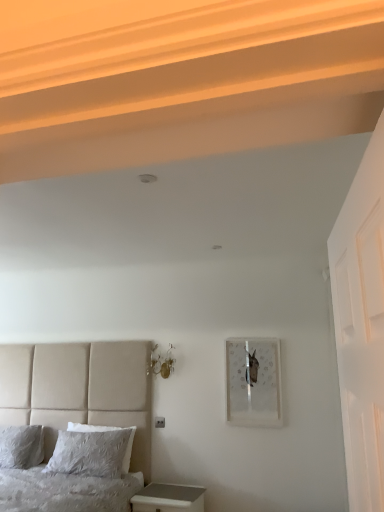
Question: Looking at their shapes, would you say beige fabric bed at lower left, positioned as the second bed in back-to-front order, is wider or thinner than metallic glass sconces at upper center?

Choices:
 (A) wide
 (B) thin

Answer: (A)

Question: In terms of height, does beige fabric bed at lower left, positioned as the second bed in back-to-front order, look taller or shorter compared to metallic glass sconces at upper center?

Choices:
 (A) tall
 (B) short

Answer: (A)

Question: Estimate the real-world distances between objects in this image. Which object is closer to the white soft pillow at lower left, the second pillow when ordered from right to left?

Choices:
 (A) white textured pillow at lower left, which is the 1th pillow from right to left
 (B) beige fabric bed at lower left, positioned as the second bed in back-to-front order
 (C) matte glass picture frame at upper right
 (D) white glossy nightstand at lower left
 (E) textured gray pillow at lower left, which is the 1th bed from back to front

Answer: (B)

Question: Estimate the real-world distances between objects in this image. Which object is closer to the white glossy nightstand at lower left?

Choices:
 (A) metallic glass sconces at upper center
 (B) textured gray pillow at lower left, which is the 1th bed from back to front
 (C) white textured pillow at lower left, which is the 1th pillow from right to left
 (D) beige fabric bed at lower left, positioned as the second bed in back-to-front order
 (E) white soft pillow at lower left, the second pillow when ordered from right to left

Answer: (B)